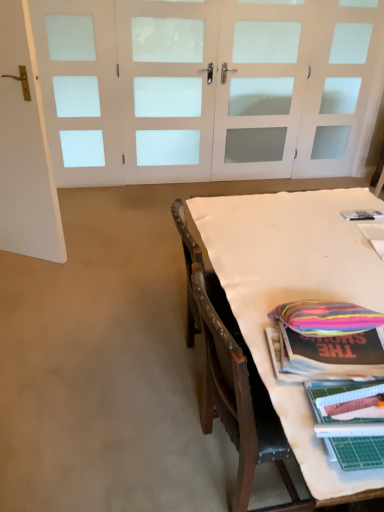
Describe the element at coordinates (292, 292) in the screenshot. The height and width of the screenshot is (512, 384). I see `white fabric-covered table at lower right` at that location.

Measure the distance between point (188, 23) and camera.

Point (188, 23) is 3.43 meters from camera.

Find the location of a particular element. This screenshot has width=384, height=512. white fabric-covered table at lower right is located at coordinates (292, 292).

From the image's perspective, is white fabric-covered table at lower right beneath white matte door at left, placed as the 2th door when sorted from right to left?

Yes, from the image's perspective, white fabric-covered table at lower right is beneath white matte door at left, placed as the 2th door when sorted from right to left.

Is white fabric-covered table at lower right in front of or behind white matte door at left, placed as the 2th door when sorted from right to left, in the image?

Visually, white fabric-covered table at lower right is located in front of white matte door at left, placed as the 2th door when sorted from right to left.

Between white fabric-covered table at lower right and white matte door at left, placed as the 1th door when sorted from front to back, which one has smaller width?

white matte door at left, placed as the 1th door when sorted from front to back, is thinner.

From a real-world perspective, is white fabric-covered table at lower right positioned under white matte door at left, the 1th door in the left-to-right sequence, based on gravity?

Yes.

Is white frosted glass door at upper center, the first door when ordered from back to front, touching white fabric-covered table at lower right?

They are not placed beside each other.

From a real-world perspective, is white frosted glass door at upper center, which appears as the 1th door when viewed from the right, located beneath white fabric-covered table at lower right?

No, from a real-world perspective, white frosted glass door at upper center, which appears as the 1th door when viewed from the right, is not under white fabric-covered table at lower right.

From the image's perspective, which one is positioned higher, white frosted glass door at upper center, the second door positioned from the left, or white fabric-covered table at lower right?

From the image's view, white frosted glass door at upper center, the second door positioned from the left, is above.

From the image's perspective, relative to white matte door at left, placed as the 1th door when sorted from front to back, is white frosted glass door at upper center, which is the second door from front to back, above or below?

Clearly, from the image's perspective, white frosted glass door at upper center, which is the second door from front to back, is above white matte door at left, placed as the 1th door when sorted from front to back.

Considering their positions, is white frosted glass door at upper center, the second door positioned from the left, located in front of or behind white matte door at left, placed as the 1th door when sorted from front to back?

white frosted glass door at upper center, the second door positioned from the left, is behind white matte door at left, placed as the 1th door when sorted from front to back.

How many degrees apart are the facing directions of white frosted glass door at upper center, which appears as the 1th door when viewed from the right, and white matte door at left, placed as the 2th door when sorted from right to left?

151 degrees separate the facing orientations of white frosted glass door at upper center, which appears as the 1th door when viewed from the right, and white matte door at left, placed as the 2th door when sorted from right to left.

Between white frosted glass door at upper center, which is the second door from front to back, and white matte door at left, placed as the 1th door when sorted from front to back, which one has more height?

white frosted glass door at upper center, which is the second door from front to back.

Would you say white matte door at left, placed as the 1th door when sorted from front to back, is inside or outside white fabric-covered table at lower right?

white matte door at left, placed as the 1th door when sorted from front to back, is outside white fabric-covered table at lower right.

In order to click on table in front of the white matte door at left, positioned as the second door in back-to-front order in this screenshot , I will do `click(292, 292)`.

From a real-world perspective, does white matte door at left, placed as the 2th door when sorted from right to left, sit lower than white fabric-covered table at lower right?

No.

From the image's perspective, which object appears higher, white matte door at left, placed as the 2th door when sorted from right to left, or white fabric-covered table at lower right?

From the image's view, white matte door at left, placed as the 2th door when sorted from right to left, is above.

Is white matte door at left, placed as the 2th door when sorted from right to left, shorter than white frosted glass door at upper center, which is the second door from front to back?

Indeed, white matte door at left, placed as the 2th door when sorted from right to left, has a lesser height compared to white frosted glass door at upper center, which is the second door from front to back.

Between white matte door at left, positioned as the second door in back-to-front order, and white frosted glass door at upper center, which is the second door from front to back, which one has smaller width?

Thinner between the two is white frosted glass door at upper center, which is the second door from front to back.

Is white matte door at left, placed as the 2th door when sorted from right to left, spatially inside white frosted glass door at upper center, the first door when ordered from back to front, or outside of it?

white matte door at left, placed as the 2th door when sorted from right to left, is not inside white frosted glass door at upper center, the first door when ordered from back to front, it's outside.

Considering the sizes of objects white matte door at left, positioned as the second door in back-to-front order, and white frosted glass door at upper center, the second door positioned from the left, in the image provided, who is bigger, white matte door at left, positioned as the second door in back-to-front order, or white frosted glass door at upper center, the second door positioned from the left,?

Bigger between the two is white matte door at left, positioned as the second door in back-to-front order.

Is white fabric-covered table at lower right smaller than white frosted glass door at upper center, the second door positioned from the left?

No, white fabric-covered table at lower right is not smaller than white frosted glass door at upper center, the second door positioned from the left.

Is white fabric-covered table at lower right facing away from white frosted glass door at upper center, which is the second door from front to back?

No, white fabric-covered table at lower right is not facing away from white frosted glass door at upper center, which is the second door from front to back.

In order to click on the 2nd door above when counting from the white fabric-covered table at lower right (from the image's perspective) in this screenshot , I will do `click(167, 88)`.

Which door is the 1st one when counting from the back of the white fabric-covered table at lower right? Please provide its 2D coordinates.

[(25, 148)]

Find the location of a particular element. table located underneath the white frosted glass door at upper center, the second door positioned from the left (from a real-world perspective) is located at coordinates (292, 292).

Looking at the image, which one is located further to white frosted glass door at upper center, the first door when ordered from back to front, white fabric-covered table at lower right or white matte door at left, the 1th door in the left-to-right sequence?

Among the two, white fabric-covered table at lower right is located further to white frosted glass door at upper center, the first door when ordered from back to front.

Looking at the image, which one is located closer to white fabric-covered table at lower right, white matte door at left, positioned as the second door in back-to-front order, or white frosted glass door at upper center, the first door when ordered from back to front?

Based on the image, white matte door at left, positioned as the second door in back-to-front order, appears to be nearer to white fabric-covered table at lower right.

From the image, which object appears to be farther from white matte door at left, the 1th door in the left-to-right sequence, white frosted glass door at upper center, which appears as the 1th door when viewed from the right, or white fabric-covered table at lower right?

The object further to white matte door at left, the 1th door in the left-to-right sequence, is white frosted glass door at upper center, which appears as the 1th door when viewed from the right.

Which object lies nearer to the anchor point white matte door at left, positioned as the second door in back-to-front order, white fabric-covered table at lower right or white frosted glass door at upper center, which is the second door from front to back?

white fabric-covered table at lower right.

Based on their spatial positions, is white frosted glass door at upper center, the second door positioned from the left, or white matte door at left, placed as the 1th door when sorted from front to back, further from white fabric-covered table at lower right?

white frosted glass door at upper center, the second door positioned from the left, is positioned further to the anchor white fabric-covered table at lower right.

Based on the photo, when comparing their distances from white frosted glass door at upper center, the first door when ordered from back to front, does white matte door at left, positioned as the second door in back-to-front order, or white fabric-covered table at lower right seem further?

white fabric-covered table at lower right lies further to white frosted glass door at upper center, the first door when ordered from back to front, than the other object.

At what (x,y) coordinates should I click in order to perform the action: click on door located between white fabric-covered table at lower right and white frosted glass door at upper center, the first door when ordered from back to front, in the depth direction. Please return your answer as a coordinate pair (x, y). The height and width of the screenshot is (512, 384). Looking at the image, I should click on (25, 148).